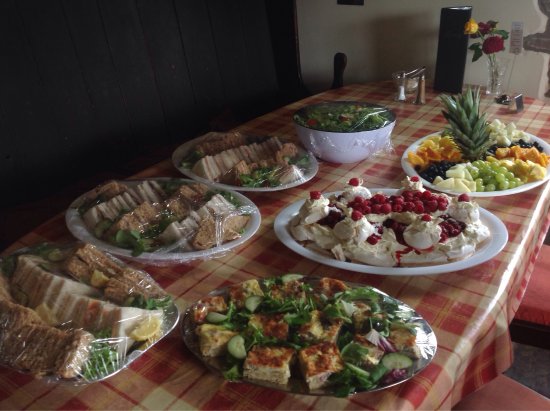
Where is `middle trays of food`? middle trays of food is located at coordinates (176, 230), (362, 234), (266, 165).